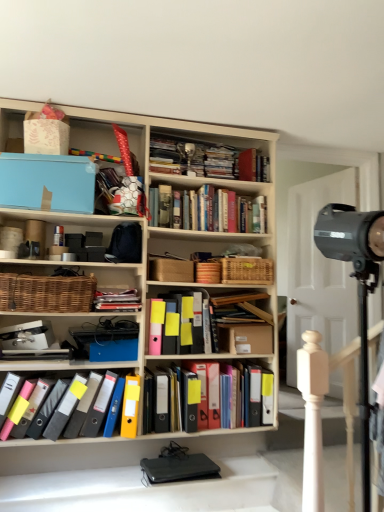
Question: Can woven brown basket at left be found inside matte black folders at center, the third book in the bottom-to-top sequence?

Choices:
 (A) no
 (B) yes

Answer: (A)

Question: Is matte black folders at center, the third book in the bottom-to-top sequence, closer to the viewer compared to woven brown basket at left?

Choices:
 (A) yes
 (B) no

Answer: (B)

Question: Is matte black folders at center, the 2th book in the top-to-bottom sequence, wider than woven brown basket at left?

Choices:
 (A) no
 (B) yes

Answer: (A)

Question: From a real-world perspective, is matte black folders at center, the 2th book in the top-to-bottom sequence, below woven brown basket at left?

Choices:
 (A) yes
 (B) no

Answer: (A)

Question: Is matte black folders at center, the third book in the bottom-to-top sequence, turned away from woven brown basket at left?

Choices:
 (A) yes
 (B) no

Answer: (B)

Question: From the image's perspective, is multicolored plastic binders at center, the fourth book from the top, positioned above or below hardcover books at center, the 1th book from the top?

Choices:
 (A) above
 (B) below

Answer: (B)

Question: From a real-world perspective, is multicolored plastic binders at center, marked as the first book in a bottom-to-top arrangement, positioned above or below hardcover books at center, marked as the fourth book in a bottom-to-top arrangement?

Choices:
 (A) above
 (B) below

Answer: (B)

Question: Is multicolored plastic binders at center, marked as the first book in a bottom-to-top arrangement, wider or thinner than hardcover books at center, the 1th book from the top?

Choices:
 (A) thin
 (B) wide

Answer: (A)

Question: From their relative heights in the image, would you say multicolored plastic binders at center, the fourth book from the top, is taller or shorter than hardcover books at center, marked as the fourth book in a bottom-to-top arrangement?

Choices:
 (A) short
 (B) tall

Answer: (B)

Question: Does point (246, 259) appear closer or farther from the camera than point (367, 499)?

Choices:
 (A) farther
 (B) closer

Answer: (A)

Question: In terms of width, does woven brown basket at center look wider or thinner when compared to black metallic spotlight at right?

Choices:
 (A) thin
 (B) wide

Answer: (A)

Question: Looking at the image, does woven brown basket at center seem bigger or smaller compared to black metallic spotlight at right?

Choices:
 (A) small
 (B) big

Answer: (A)

Question: Is woven brown basket at center inside the boundaries of black metallic spotlight at right, or outside?

Choices:
 (A) inside
 (B) outside

Answer: (B)

Question: Is point (34, 305) closer or farther from the camera than point (225, 283)?

Choices:
 (A) farther
 (B) closer

Answer: (B)

Question: Considering their positions, is woven brown basket at left located in front of or behind woven brown basket at center?

Choices:
 (A) behind
 (B) front

Answer: (B)